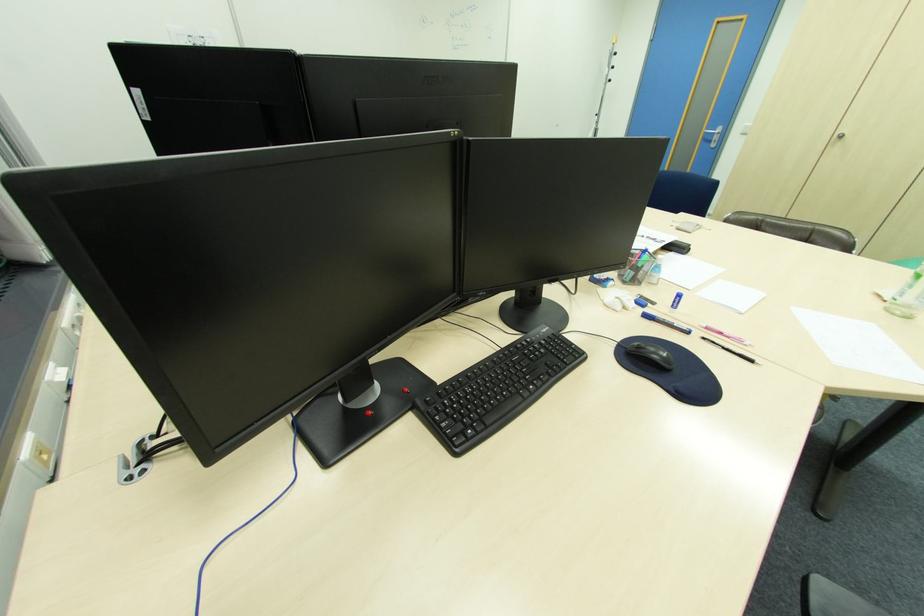
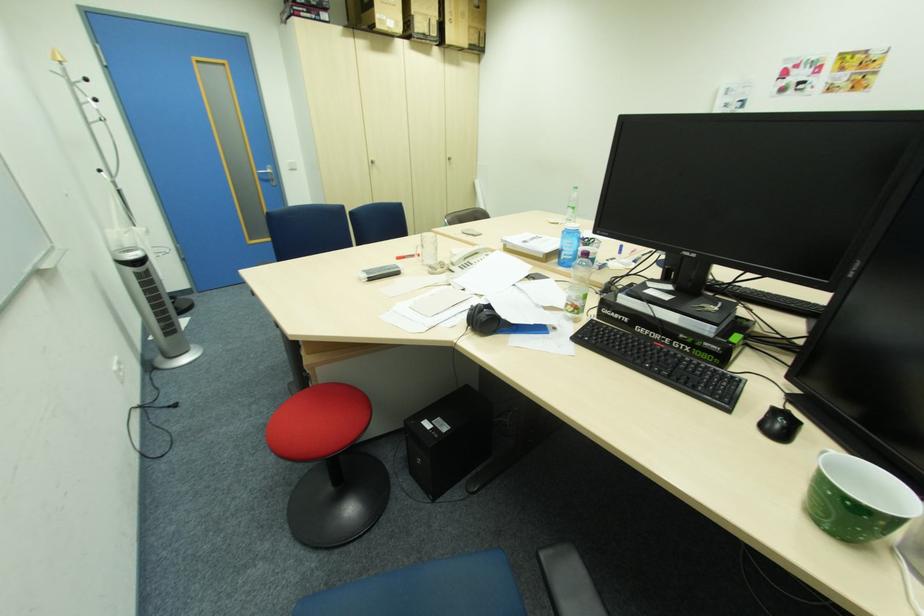
In the second image, find the point that corresponds to point (710, 134) in the first image.

(264, 174)